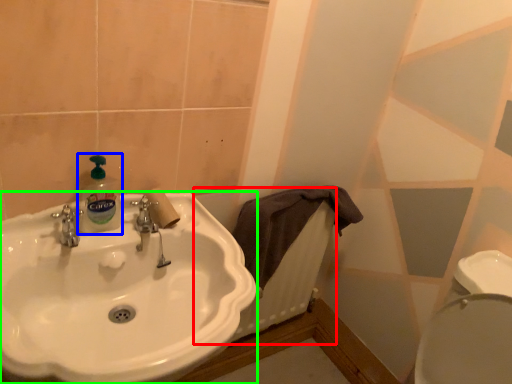
Question: Which is nearer to the radiator (highlighted by a red box)? cleaning product (highlighted by a blue box) or sink (highlighted by a green box).

Choices:
 (A) cleaning product
 (B) sink

Answer: (B)